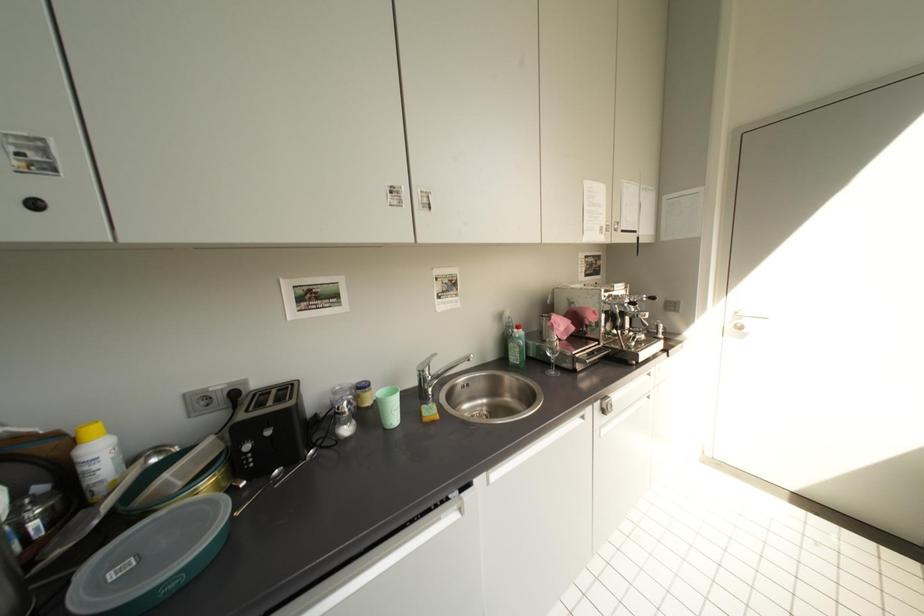
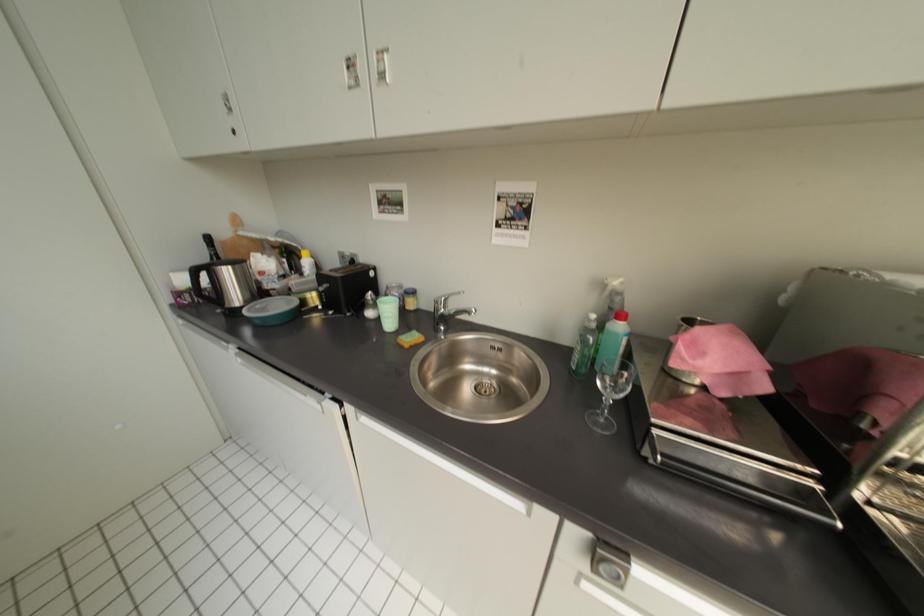
The first image is from the beginning of the video and the second image is from the end. How did the camera likely rotate when shooting the video?

The camera rotated toward left-down.